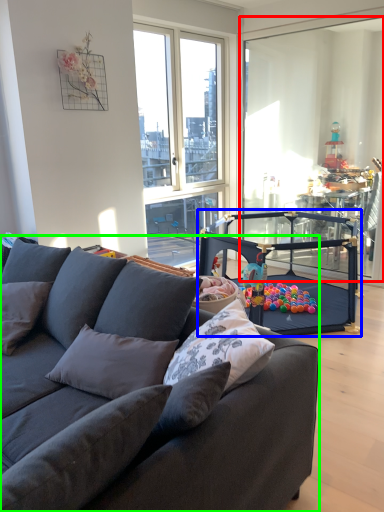
Question: Which is nearer to the screen door (highlighted by a red box)? armchair (highlighted by a blue box) or studio couch (highlighted by a green box).

Choices:
 (A) armchair
 (B) studio couch

Answer: (A)